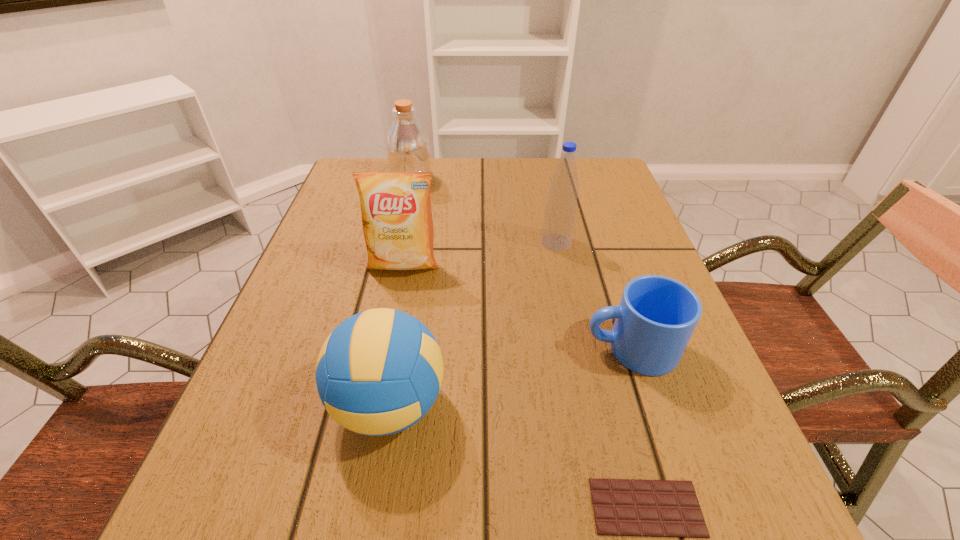
Locate an element on the screen. This screenshot has height=540, width=960. the third closest object to the farthest object is located at coordinates (379, 372).

Identify which object is located as the nearest to the crisp (potato chip). Please provide its 2D coordinates. Your answer should be formatted as a tuple, i.e. [(x, y)], where the tuple contains the x and y coordinates of a point satisfying the conditions above.

[(379, 372)]

Find the location of a particular element. This screenshot has width=960, height=540. vacant space that satisfies the following two spatial constraints: 1. on the front side of the farthest object; 2. on the left side of the water bottle is located at coordinates (397, 242).